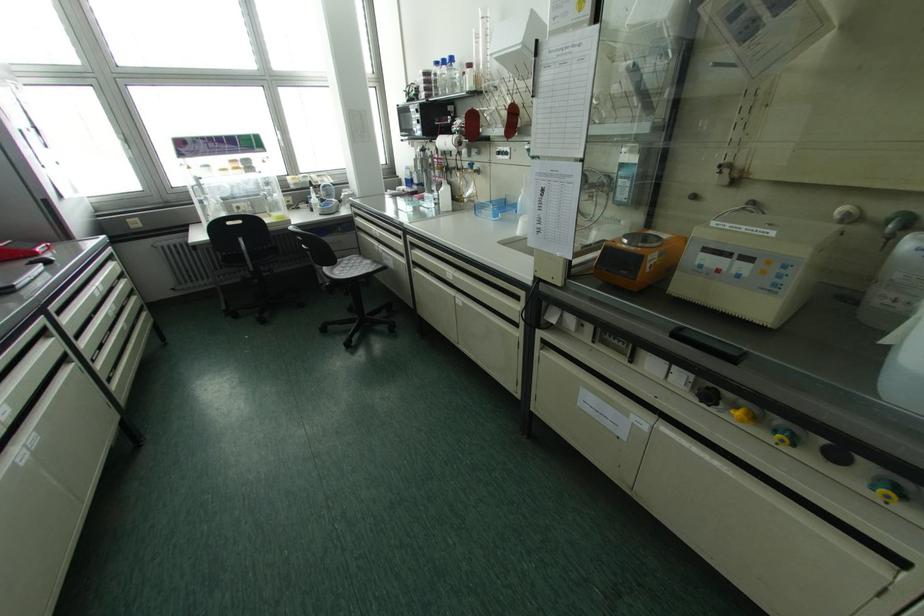
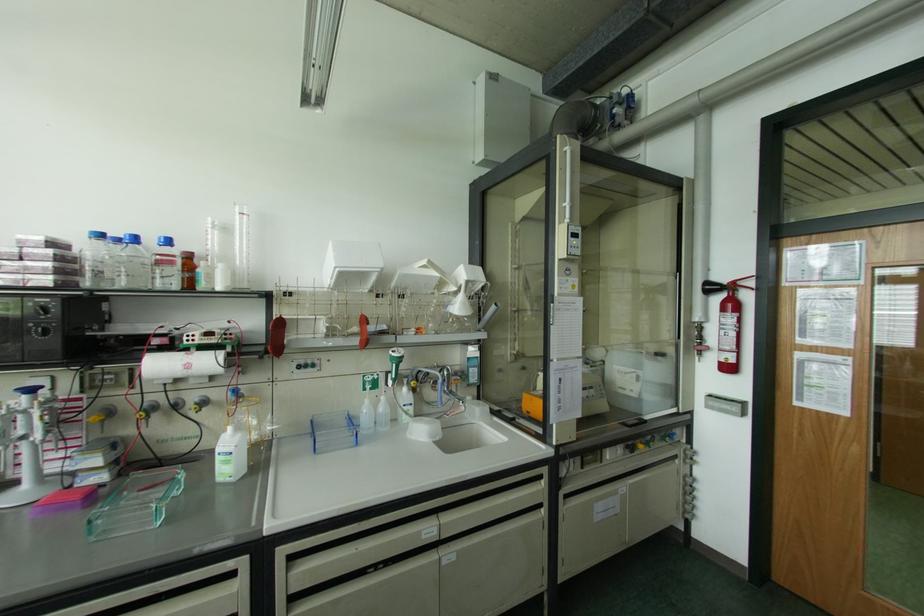
Where in the second image is the point corresponding to pixel 435 63 from the first image?

(101, 236)